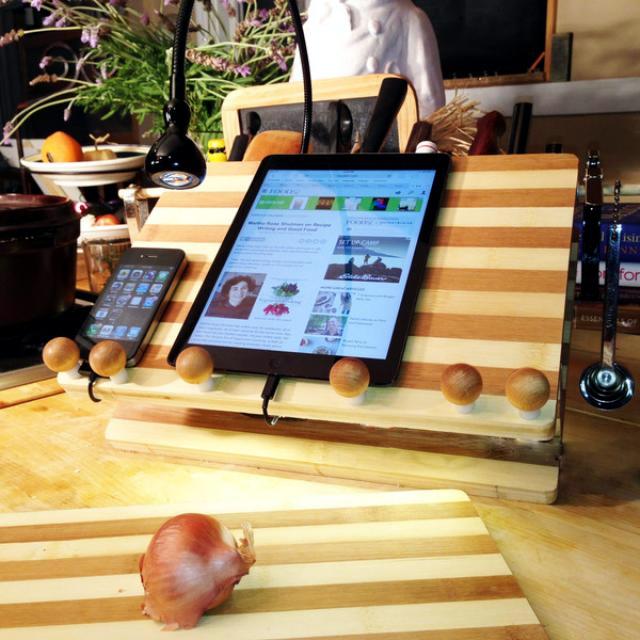
Find the location of a particular element. cutting board is located at coordinates (64, 579).